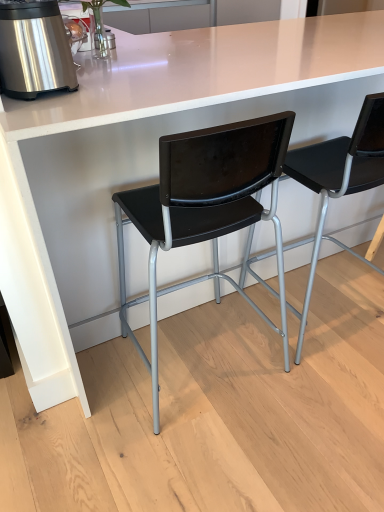
Locate an element on the screen. black plastic chair at center, positioned as the second chair in left-to-right order is located at coordinates (339, 176).

Image resolution: width=384 pixels, height=512 pixels. Identify the location of black plastic chair at center, which is counted as the 2th chair, starting from the right. (205, 207).

This screenshot has height=512, width=384. I want to click on the 1st chair to the right when counting from the stainless steel appliance at left, so click(x=205, y=207).

From a real-world perspective, which is physically above, black plastic chair at center, which is counted as the 2th chair, starting from the right, or stainless steel appliance at left?

From a 3D spatial view, stainless steel appliance at left is above.

Based on the photo, which is more to the left, black plastic chair at center, which is counted as the 2th chair, starting from the right, or stainless steel appliance at left?

stainless steel appliance at left is more to the left.

Is the surface of black plastic chair at center, which is the first chair from left to right, in direct contact with stainless steel appliance at left?

black plastic chair at center, which is the first chair from left to right, and stainless steel appliance at left are clearly separated.

From the image's perspective, who appears lower, stainless steel appliance at left or black plastic chair at center, which is counted as the 2th chair, starting from the right?

black plastic chair at center, which is counted as the 2th chair, starting from the right, is shown below in the image.

Considering the positions of objects stainless steel appliance at left and black plastic chair at center, which is counted as the 2th chair, starting from the right, in the image provided, who is in front, stainless steel appliance at left or black plastic chair at center, which is counted as the 2th chair, starting from the right,?

black plastic chair at center, which is counted as the 2th chair, starting from the right.

Considering the sizes of stainless steel appliance at left and black plastic chair at center, which is the first chair from left to right, in the image, is stainless steel appliance at left wider or thinner than black plastic chair at center, which is the first chair from left to right,?

In the image, stainless steel appliance at left appears to be more narrow than black plastic chair at center, which is the first chair from left to right.

From a real-world perspective, is stainless steel appliance at left below black plastic chair at center, which is counted as the 2th chair, starting from the right?

No, from a real-world perspective, stainless steel appliance at left is not beneath black plastic chair at center, which is counted as the 2th chair, starting from the right.

Considering the positions of objects black plastic chair at center, which is the first chair from left to right, and black plastic chair at center, positioned as the second chair in left-to-right order, in the image provided, who is in front, black plastic chair at center, which is the first chair from left to right, or black plastic chair at center, positioned as the second chair in left-to-right order,?

black plastic chair at center, which is the first chair from left to right, is in front.

This screenshot has height=512, width=384. I want to click on chair that is below the black plastic chair at center, which appears as the first chair when viewed from the right (from the image's perspective), so click(205, 207).

Visually, is black plastic chair at center, which is counted as the 2th chair, starting from the right, positioned to the left or to the right of black plastic chair at center, which appears as the first chair when viewed from the right?

From the image, it's evident that black plastic chair at center, which is counted as the 2th chair, starting from the right, is to the left of black plastic chair at center, which appears as the first chair when viewed from the right.

From a real-world perspective, between black plastic chair at center, which is the first chair from left to right, and black plastic chair at center, which appears as the first chair when viewed from the right, who is vertically higher?

black plastic chair at center, which is the first chair from left to right, from a real-world perspective.

Is point (7, 6) in front of point (367, 138)?

Yes, point (7, 6) is closer to viewer.

Does stainless steel appliance at left come in front of black plastic chair at center, which appears as the first chair when viewed from the right?

Yes.

Based on the photo, is stainless steel appliance at left outside of black plastic chair at center, positioned as the second chair in left-to-right order?

Yes, stainless steel appliance at left is not within black plastic chair at center, positioned as the second chair in left-to-right order.

From the image's perspective, is stainless steel appliance at left under black plastic chair at center, which appears as the first chair when viewed from the right?

No, from the image's perspective, stainless steel appliance at left is not beneath black plastic chair at center, which appears as the first chair when viewed from the right.

Is black plastic chair at center, which appears as the first chair when viewed from the right, positioned behind black plastic chair at center, which is counted as the 2th chair, starting from the right?

Yes, black plastic chair at center, which appears as the first chair when viewed from the right, is further from the viewer.

Are black plastic chair at center, which appears as the first chair when viewed from the right, and black plastic chair at center, which is counted as the 2th chair, starting from the right, far apart?

They are positioned close to each other.

Looking at this image, can you tell me how much black plastic chair at center, which appears as the first chair when viewed from the right, and black plastic chair at center, which is the first chair from left to right, differ in facing direction?

The angle between the facing direction of black plastic chair at center, which appears as the first chair when viewed from the right, and the facing direction of black plastic chair at center, which is the first chair from left to right, is 2.18 degrees.

From the image's perspective, does black plastic chair at center, which appears as the first chair when viewed from the right, appear lower than black plastic chair at center, which is the first chair from left to right?

Incorrect, from the image's perspective, black plastic chair at center, which appears as the first chair when viewed from the right, is higher than black plastic chair at center, which is the first chair from left to right.

Between black plastic chair at center, which appears as the first chair when viewed from the right, and stainless steel appliance at left, which one has larger size?

Bigger between the two is black plastic chair at center, which appears as the first chair when viewed from the right.

Looking at this image, is the depth of black plastic chair at center, which appears as the first chair when viewed from the right, greater than that of stainless steel appliance at left?

Yes.

Between black plastic chair at center, positioned as the second chair in left-to-right order, and stainless steel appliance at left, which one has smaller width?

stainless steel appliance at left.

Can you see black plastic chair at center, positioned as the second chair in left-to-right order, touching stainless steel appliance at left?

No, black plastic chair at center, positioned as the second chair in left-to-right order, is not in contact with stainless steel appliance at left.

Starting from the stainless steel appliance at left, which chair is the 1st one to the right? Please provide its 2D coordinates.

[(205, 207)]

Where is `chair that is the 2nd object located below the stainless steel appliance at left (from the image's perspective)`? The width and height of the screenshot is (384, 512). chair that is the 2nd object located below the stainless steel appliance at left (from the image's perspective) is located at coordinates (205, 207).

Which object lies nearer to the anchor point black plastic chair at center, which appears as the first chair when viewed from the right, stainless steel appliance at left or black plastic chair at center, which is counted as the 2th chair, starting from the right?

Based on the image, black plastic chair at center, which is counted as the 2th chair, starting from the right, appears to be nearer to black plastic chair at center, which appears as the first chair when viewed from the right.

From the image, which object appears to be nearer to black plastic chair at center, which is the first chair from left to right, stainless steel appliance at left or black plastic chair at center, positioned as the second chair in left-to-right order?

black plastic chair at center, positioned as the second chair in left-to-right order, is closer to black plastic chair at center, which is the first chair from left to right.

From the image, which object appears to be farther from black plastic chair at center, which appears as the first chair when viewed from the right, black plastic chair at center, which is counted as the 2th chair, starting from the right, or stainless steel appliance at left?

The object further to black plastic chair at center, which appears as the first chair when viewed from the right, is stainless steel appliance at left.

Looking at the image, which one is located further to stainless steel appliance at left, black plastic chair at center, which appears as the first chair when viewed from the right, or black plastic chair at center, which is counted as the 2th chair, starting from the right?

black plastic chair at center, which appears as the first chair when viewed from the right, is positioned further to the anchor stainless steel appliance at left.

Looking at this image, estimate the real-world distances between objects in this image. Which object is closer to black plastic chair at center, which is counted as the 2th chair, starting from the right, black plastic chair at center, which appears as the first chair when viewed from the right, or stainless steel appliance at left?

black plastic chair at center, which appears as the first chair when viewed from the right, is positioned closer to the anchor black plastic chair at center, which is counted as the 2th chair, starting from the right.

Looking at the image, which one is located closer to stainless steel appliance at left, black plastic chair at center, which is counted as the 2th chair, starting from the right, or black plastic chair at center, which appears as the first chair when viewed from the right?

black plastic chair at center, which is counted as the 2th chair, starting from the right, is positioned closer to the anchor stainless steel appliance at left.

Image resolution: width=384 pixels, height=512 pixels. I want to click on chair between stainless steel appliance at left and black plastic chair at center, which appears as the first chair when viewed from the right, from left to right, so click(x=205, y=207).